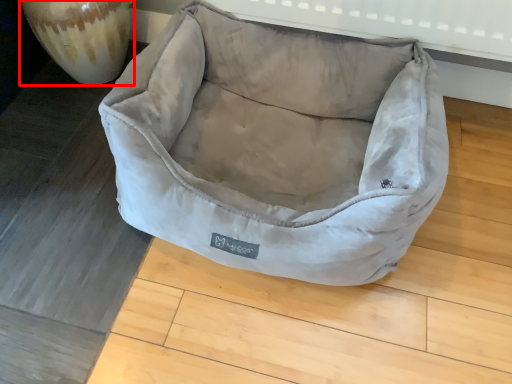
Question: Considering the relative positions of glass vase (annotated by the red box) and dog bed in the image provided, where is glass vase (annotated by the red box) located with respect to the staircase?

Choices:
 (A) right
 (B) left

Answer: (B)